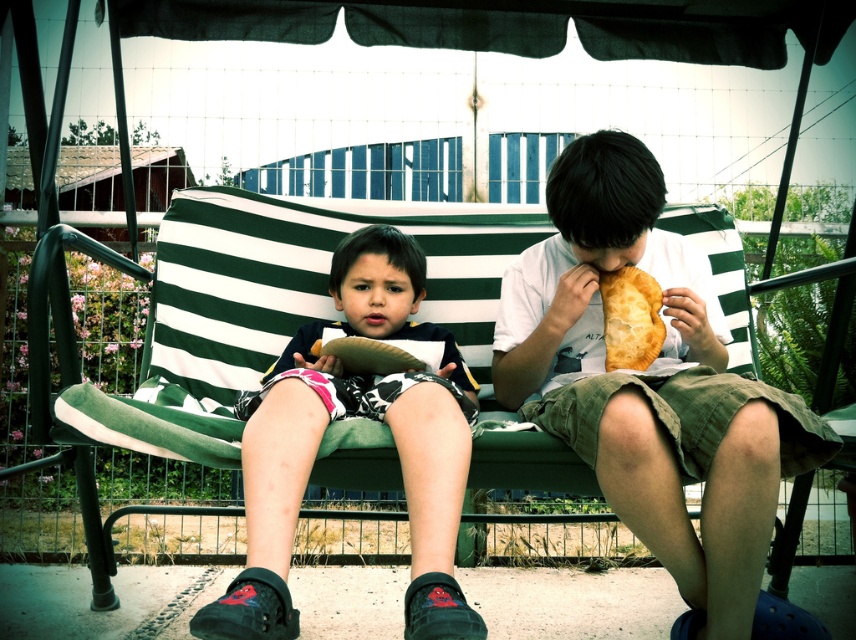
Does matte white shirt at center have a lesser height compared to black suede shoes at lower center?

No, matte white shirt at center is not shorter than black suede shoes at lower center.

Can you confirm if matte white shirt at center is wider than black suede shoes at lower center?

Correct, the width of matte white shirt at center exceeds that of black suede shoes at lower center.

Measure the distance between matte white shirt at center and camera.

matte white shirt at center and camera are 4.24 feet apart.

Find the location of a particular element. The width and height of the screenshot is (856, 640). matte white shirt at center is located at coordinates point(651,385).

Between matte white shirt at center and green striped cushion at center, which one is positioned higher?

Positioned higher is green striped cushion at center.

Between matte white shirt at center and green striped cushion at center, which one appears on the left side from the viewer's perspective?

Positioned to the left is green striped cushion at center.

Does point (711, 340) come farther from viewer compared to point (210, 349)?

No, it is in front of (210, 349).

Locate an element on the screen. Image resolution: width=856 pixels, height=640 pixels. matte white shirt at center is located at coordinates (651, 385).

Which is below, matte white shirt at center or golden flaky pie at center?

matte white shirt at center

Looking at this image, who is shorter, matte white shirt at center or golden flaky pie at center?

golden flaky pie at center

Describe the element at coordinates (651, 385) in the screenshot. I see `matte white shirt at center` at that location.

Identify the location of matte white shirt at center. (651, 385).